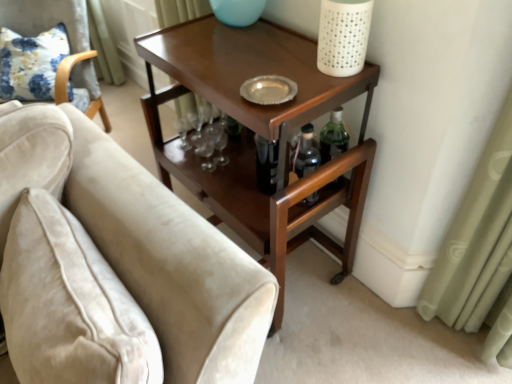
Question: Considering the relative positions of shiny brown wood side table at center and velvet beige armchair at left in the image provided, is shiny brown wood side table at center to the left or to the right of velvet beige armchair at left?

Choices:
 (A) left
 (B) right

Answer: (B)

Question: Is point (x=337, y=195) closer or farther from the camera than point (x=68, y=23)?

Choices:
 (A) farther
 (B) closer

Answer: (B)

Question: Based on their relative distances, which object is nearer to the floral fabric pillow at upper left?

Choices:
 (A) velvet beige armchair at left
 (B) velvet beige couch at lower left
 (C) shiny brown wood side table at center

Answer: (A)

Question: Based on their relative distances, which object is farther from the velvet beige armchair at left?

Choices:
 (A) floral fabric pillow at upper left
 (B) shiny brown wood side table at center
 (C) velvet beige couch at lower left

Answer: (C)